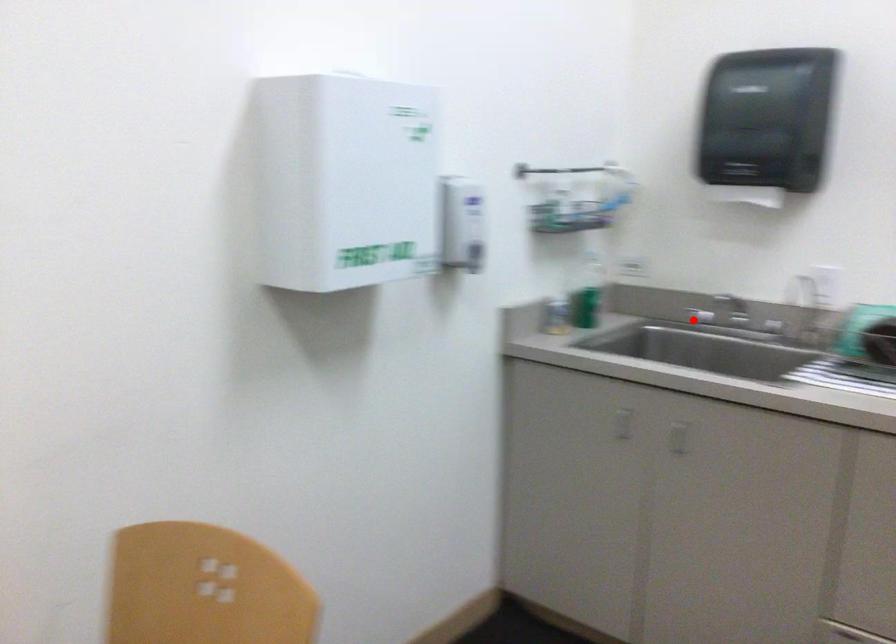
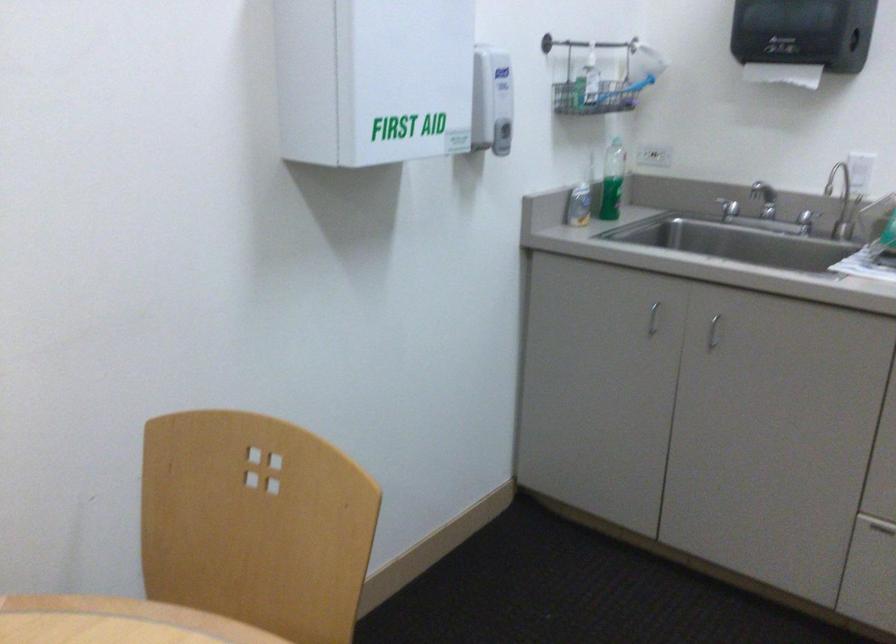
In the second image, find the point that corresponds to the highlighted location in the first image.

(728, 207)